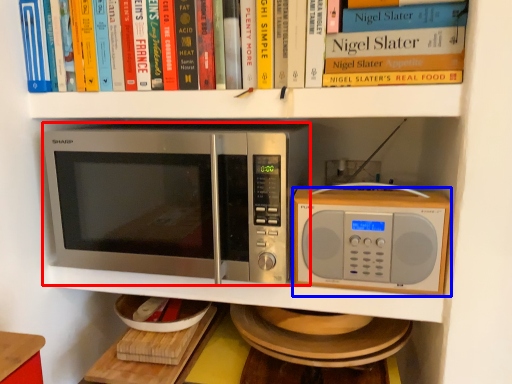
Question: Which of the following is the closest to the observer, microwave oven (highlighted by a red box) or microwave oven (highlighted by a blue box)?

Choices:
 (A) microwave oven
 (B) microwave oven

Answer: (A)